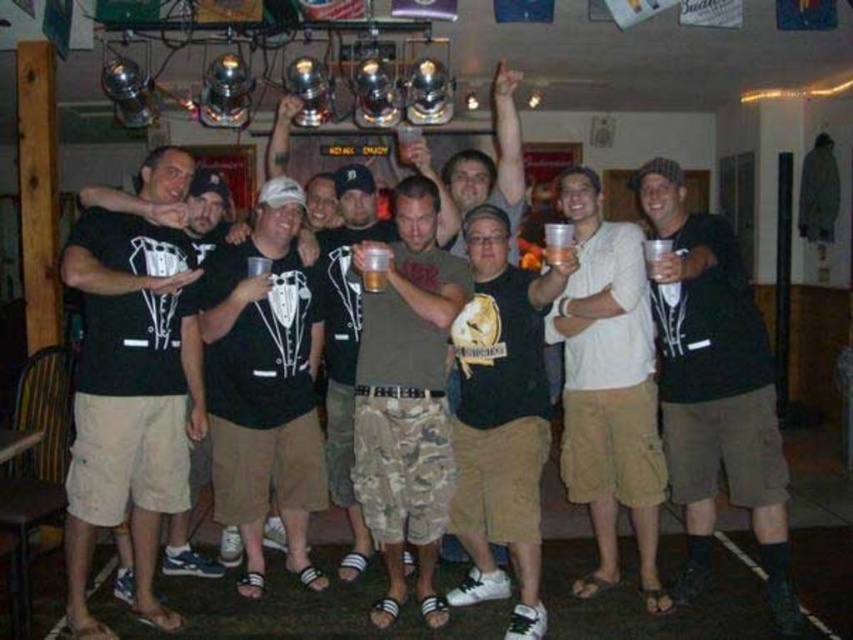
Question: Based on their relative distances, which object is farther from the translucent plastic cup at center?

Choices:
 (A) black cotton t-shirt at center
 (B) black tuxedo shirt at center
 (C) black matte tuxedo shirt at center
 (D) light beige cotton shirt at center

Answer: (A)

Question: Which object is farther from the camera taking this photo?

Choices:
 (A) black matte t-shirt at center
 (B) camouflage shorts at center

Answer: (B)

Question: Can you confirm if black matte tuxedo shirt at center is positioned above black matte t-shirt at center?

Choices:
 (A) no
 (B) yes

Answer: (B)

Question: Where is camouflage shorts at center located in relation to light beige cotton shirt at center in the image?

Choices:
 (A) above
 (B) below

Answer: (B)

Question: Is camouflage shorts at center positioned before light beige cotton shirt at center?

Choices:
 (A) yes
 (B) no

Answer: (A)

Question: Which point is closer to the camera taking this photo?

Choices:
 (A) (386, 252)
 (B) (778, 444)
 (C) (398, 230)

Answer: (A)